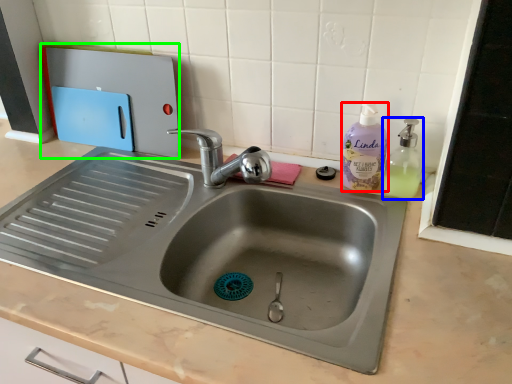
Question: Which is nearer to the cleaning product (highlighted by a red box)? soap dispenser (highlighted by a blue box) or appliance (highlighted by a green box).

Choices:
 (A) soap dispenser
 (B) appliance

Answer: (A)